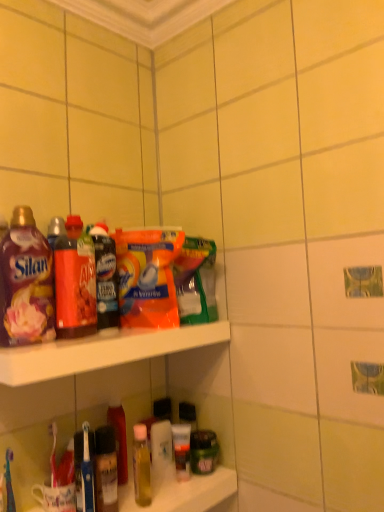
Question: Is matte plastic bottle at upper left bigger than matte red bottle at left, arranged as the second bottle when ordered from the bottom?

Choices:
 (A) no
 (B) yes

Answer: (A)

Question: Is matte plastic bottle at upper left positioned with its back to matte red bottle at left, placed as the second bottle when sorted from back to front?

Choices:
 (A) yes
 (B) no

Answer: (B)

Question: Does matte plastic bottle at upper left have a smaller size compared to matte red bottle at left, arranged as the second bottle when ordered from the bottom?

Choices:
 (A) no
 (B) yes

Answer: (B)

Question: Can matte red bottle at left, arranged as the second bottle when ordered from the bottom, be found inside matte plastic bottle at upper left?

Choices:
 (A) no
 (B) yes

Answer: (A)

Question: Considering the relative positions of matte plastic bottle at upper left and matte red bottle at left, the 2th bottle from the top, in the image provided, is matte plastic bottle at upper left to the left of matte red bottle at left, the 2th bottle from the top, from the viewer's perspective?

Choices:
 (A) no
 (B) yes

Answer: (A)

Question: In terms of height, does matte red bottle at left, arranged as the second bottle when ordered from the bottom, look taller or shorter compared to orange plastic cleaning product at center?

Choices:
 (A) short
 (B) tall

Answer: (B)

Question: Considering the positions of point (64, 234) and point (142, 253), is point (64, 234) closer or farther from the camera than point (142, 253)?

Choices:
 (A) farther
 (B) closer

Answer: (B)

Question: From a real-world perspective, is matte red bottle at left, placed as the second bottle when sorted from back to front, above or below orange plastic cleaning product at center?

Choices:
 (A) below
 (B) above

Answer: (B)

Question: From the image's perspective, is matte red bottle at left, the 2th bottle from the top, located above or below orange plastic cleaning product at center?

Choices:
 (A) above
 (B) below

Answer: (A)

Question: From a real-world perspective, is matte plastic bottle at upper left above or below matte plastic bottle at left, which is the third bottle from back to front?

Choices:
 (A) above
 (B) below

Answer: (B)

Question: Is matte plastic bottle at upper left bigger or smaller than matte plastic bottle at left, which appears as the first bottle when viewed from the front?

Choices:
 (A) big
 (B) small

Answer: (B)

Question: From their relative heights in the image, would you say matte plastic bottle at upper left is taller or shorter than matte plastic bottle at left, which appears as the first bottle when viewed from the front?

Choices:
 (A) short
 (B) tall

Answer: (A)

Question: Choose the correct answer: Is matte plastic bottle at upper left inside matte plastic bottle at left, which appears as the first bottle when viewed from the front, or outside it?

Choices:
 (A) inside
 (B) outside

Answer: (B)

Question: Considering the positions of point (122, 413) and point (59, 330), is point (122, 413) closer or farther from the camera than point (59, 330)?

Choices:
 (A) farther
 (B) closer

Answer: (A)

Question: From a real-world perspective, relative to matte red bottle at left, arranged as the second bottle when ordered from the bottom, is translucent plastic bottle at lower center, which ranks as the 1th bottle in bottom-to-top order, vertically above or below?

Choices:
 (A) above
 (B) below

Answer: (B)